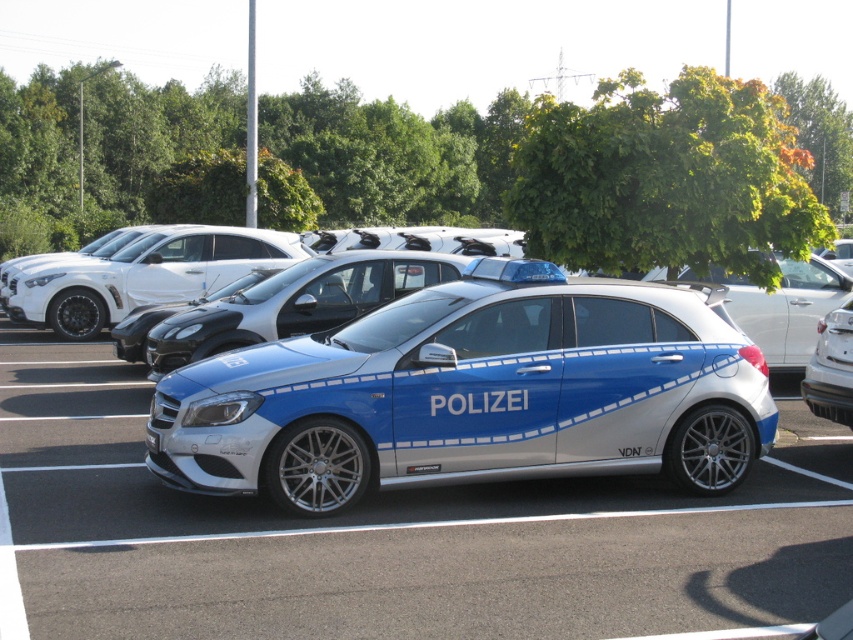
Who is positioned more to the left, white glossy sedan at center or satin silver car at center?

Positioned to the left is white glossy sedan at center.

Does white glossy sedan at center have a smaller size compared to satin silver car at center?

Incorrect, white glossy sedan at center is not smaller in size than satin silver car at center.

Who is more forward, (195, 243) or (840, 356)?

Positioned in front is point (840, 356).

In order to click on white glossy sedan at center in this screenshot , I will do `click(148, 275)`.

Is white glossy sedan at center behind black rubber line at lower center?

Yes, white glossy sedan at center is further from the viewer.

Does white glossy sedan at center appear over black rubber line at lower center?

Result: Yes, white glossy sedan at center is above black rubber line at lower center.

Which is behind, point (131, 262) or point (505, 518)?

Point (131, 262)

Where is `white glossy sedan at center`? white glossy sedan at center is located at coordinates (148, 275).

Where is `blue metallic car at center`? blue metallic car at center is located at coordinates (471, 397).

Which of these two, blue metallic car at center or satin silver car at center, stands shorter?

With less height is satin silver car at center.

Locate an element on the screen. blue metallic car at center is located at coordinates (471, 397).